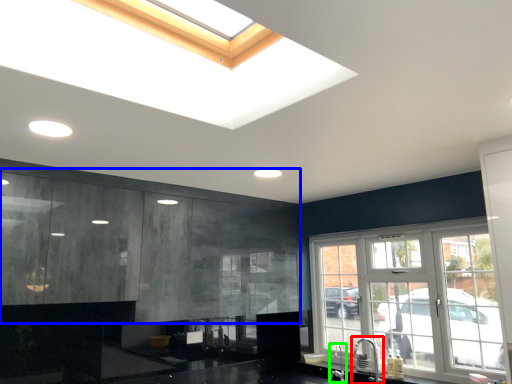
Question: Which object is the closest to the faucet (highlighted by a red box)? Choose among these: cabinetry (highlighted by a blue box) or faucet (highlighted by a green box).

Choices:
 (A) cabinetry
 (B) faucet

Answer: (B)